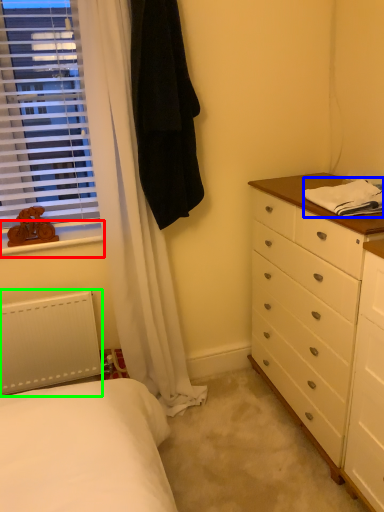
Question: Which object is the farthest from window sill (highlighted by a red box)? Choose among these: blanket (highlighted by a blue box) or radiator (highlighted by a green box).

Choices:
 (A) blanket
 (B) radiator

Answer: (A)